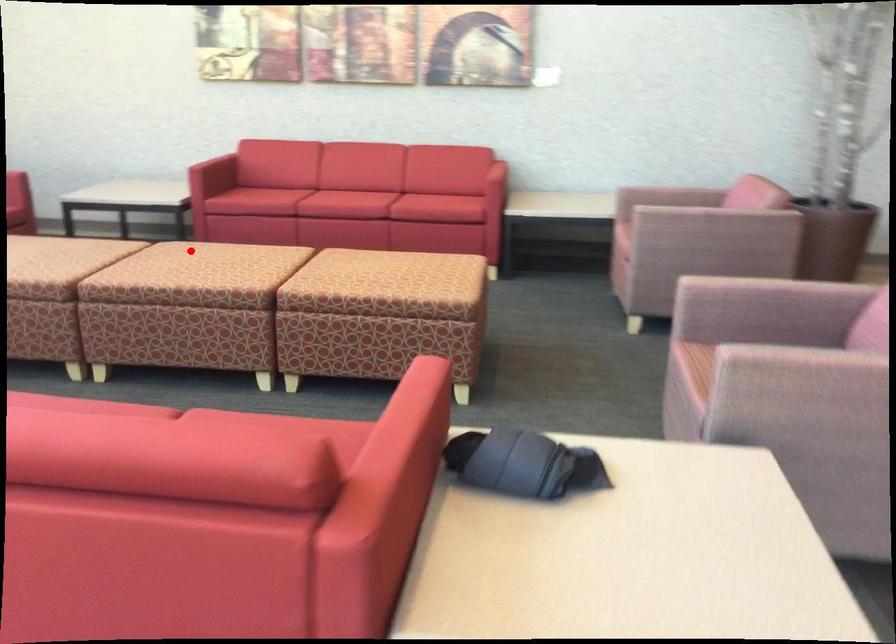
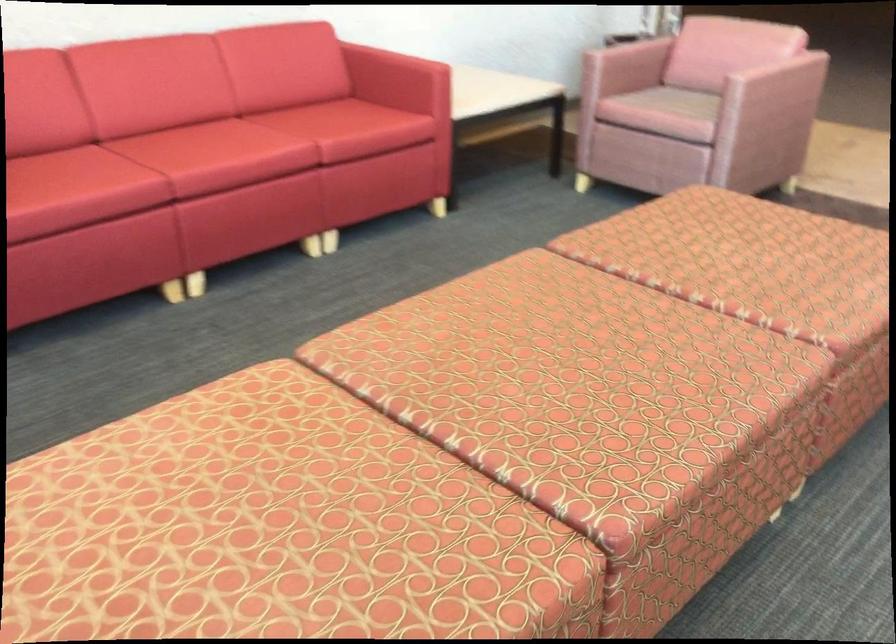
Question: A red point is marked in image1. In image2, is the corresponding 3D point closer to the camera or farther? Reply with the corresponding letter.

Choices:
 (A) The corresponding 3D point is closer.
 (B) The corresponding 3D point is farther.

Answer: (A)